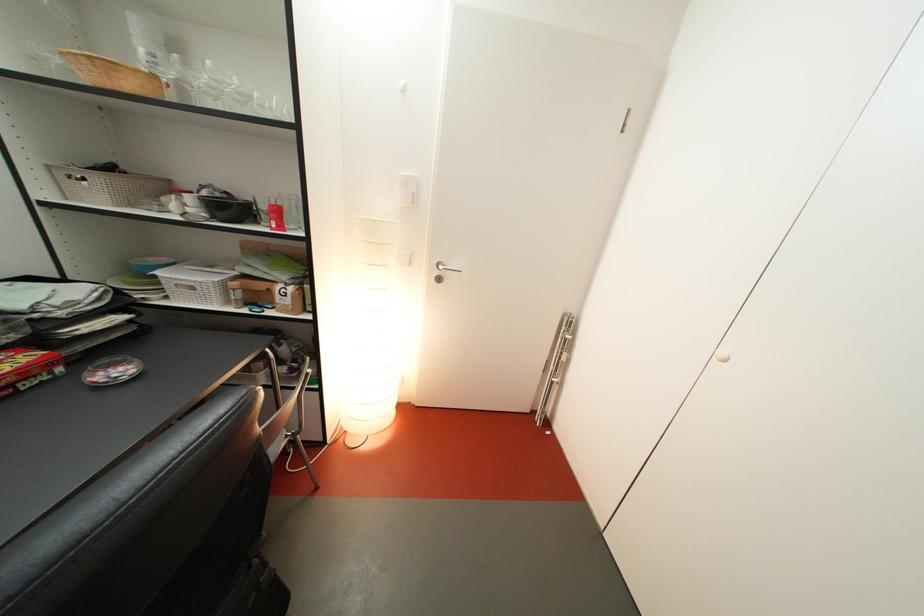
Identify the location of small blue scissors. click(258, 306).